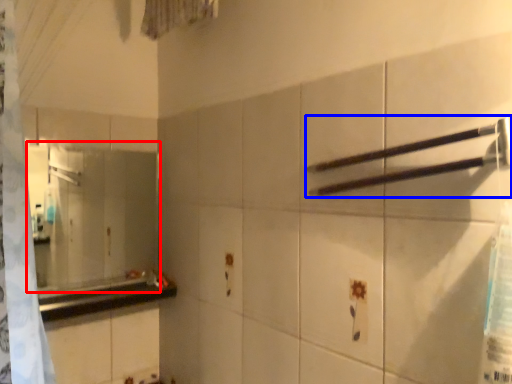
Question: Which object is closer to the camera taking this photo, mirror (highlighted by a red box) or towel bar (highlighted by a blue box)?

Choices:
 (A) mirror
 (B) towel bar

Answer: (B)